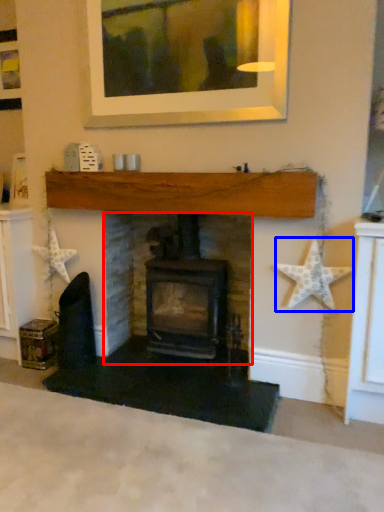
Question: Among these objects, which one is nearest to the camera, fireplace (highlighted by a red box) or starfish (highlighted by a blue box)?

Choices:
 (A) fireplace
 (B) starfish

Answer: (B)